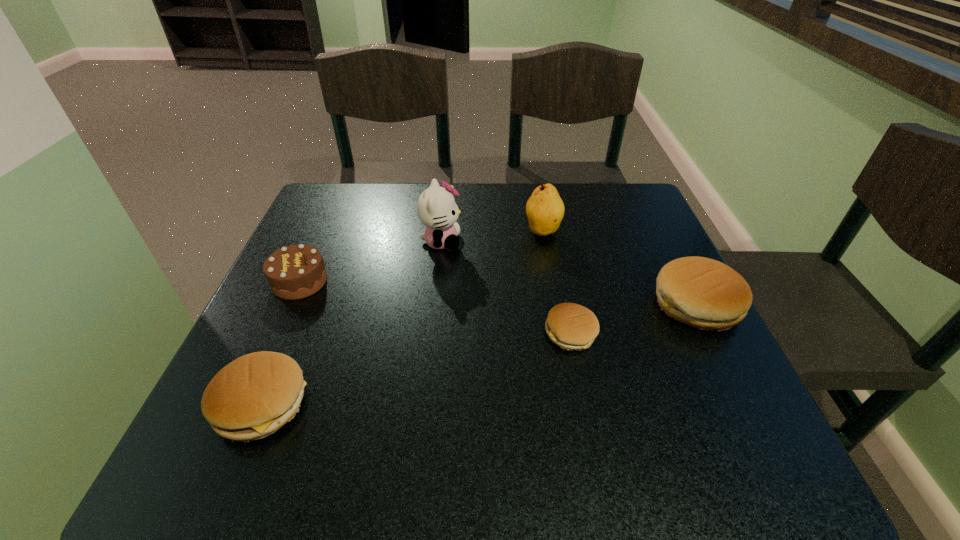
Identify the location of free space between the shortest object and the rightmost patty. The image size is (960, 540). tap(634, 319).

Where is `vacant space that is in between the nearest object and the chocolate cake`? vacant space that is in between the nearest object and the chocolate cake is located at coordinates (281, 343).

This screenshot has width=960, height=540. I want to click on vacant point located between the tallest object and the pear, so click(492, 236).

Image resolution: width=960 pixels, height=540 pixels. Find the location of `vacant area that lies between the nearest object and the fifth shortest object`. vacant area that lies between the nearest object and the fifth shortest object is located at coordinates (402, 318).

Find the location of `empty space between the kitten and the fifth shortest object`. empty space between the kitten and the fifth shortest object is located at coordinates (492, 236).

Identify the location of free space between the fifth shortest object and the shortest object. (557, 282).

Image resolution: width=960 pixels, height=540 pixels. In order to click on free space between the fourth object from right to left and the shortest patty in this screenshot , I will do `click(506, 287)`.

You are a GUI agent. You are given a task and a screenshot of the screen. Output one action in this format:
    pyautogui.click(x=<x>, y=<y>)
    Task: Click on the vacant space in between the pear and the nearest patty
    The height and width of the screenshot is (540, 960).
    Given the screenshot: What is the action you would take?
    pyautogui.click(x=402, y=318)

Point out which object is positioned as the nearest to the shortest patty. Please provide its 2D coordinates. Your answer should be formatted as a tuple, i.e. [(x, y)], where the tuple contains the x and y coordinates of a point satisfying the conditions above.

[(704, 293)]

Identify which object is located as the fifth nearest to the fourth object from right to left. Please provide its 2D coordinates. Your answer should be formatted as a tuple, i.e. [(x, y)], where the tuple contains the x and y coordinates of a point satisfying the conditions above.

[(704, 293)]